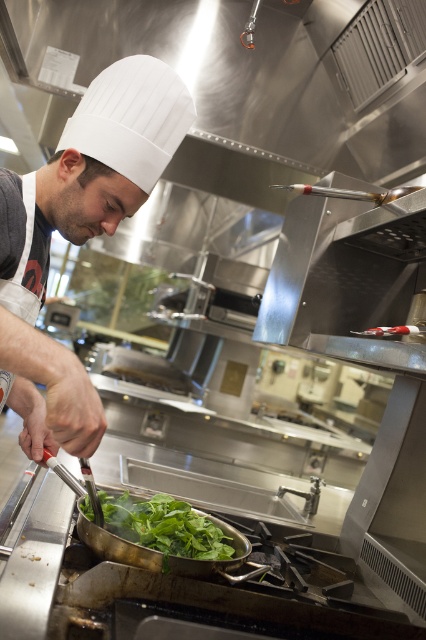
In the scene shown: Who is positioned more to the left, white matte chef hat at upper left or green leafy vegetable at center?

Positioned to the left is white matte chef hat at upper left.

Does point (46, 404) come farther from viewer compared to point (129, 522)?

No, (46, 404) is in front of (129, 522).

Is point (72, 227) farther from camera compared to point (140, 508)?

No, it is not.

Identify the location of white matte chef hat at upper left. The height and width of the screenshot is (640, 426). [77, 236].